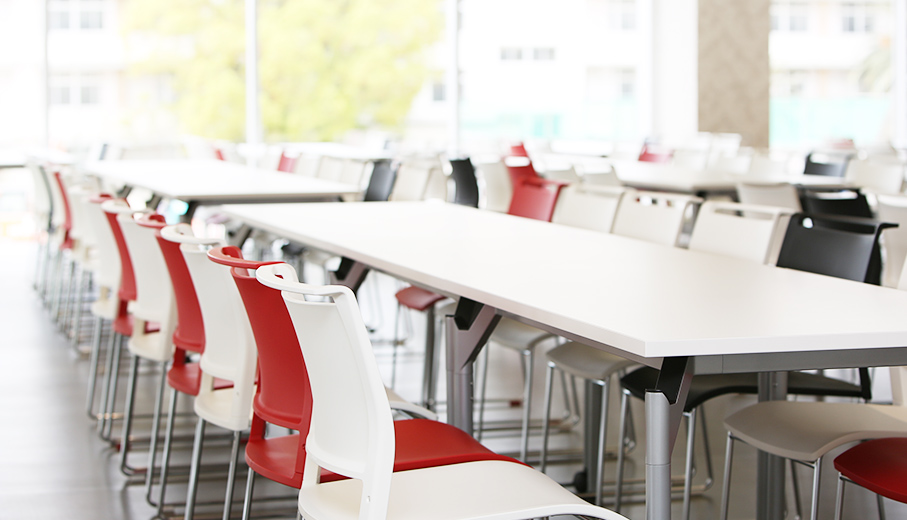
This screenshot has width=907, height=520. Find the location of `red chair`. red chair is located at coordinates (442, 442), (272, 350), (190, 333), (129, 288), (535, 196), (864, 466), (288, 162), (518, 153), (646, 156), (67, 205).